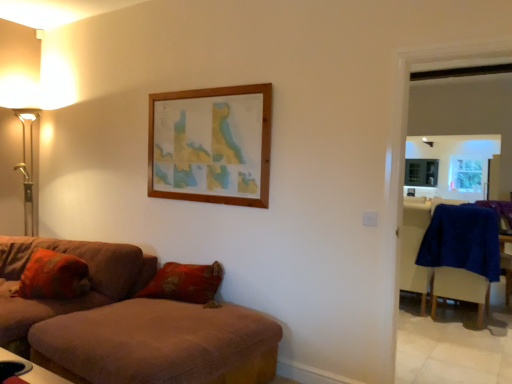
Question: Considering the relative positions of textured orange pillow at lower left and gold metallic floor lamp at left in the image provided, is textured orange pillow at lower left to the left of gold metallic floor lamp at left from the viewer's perspective?

Choices:
 (A) no
 (B) yes

Answer: (A)

Question: Does textured orange pillow at lower left turn towards gold metallic floor lamp at left?

Choices:
 (A) yes
 (B) no

Answer: (B)

Question: Is textured orange pillow at lower left completely or partially outside of gold metallic floor lamp at left?

Choices:
 (A) yes
 (B) no

Answer: (A)

Question: From the image's perspective, does textured orange pillow at lower left appear lower than gold metallic floor lamp at left?

Choices:
 (A) yes
 (B) no

Answer: (A)

Question: Is gold metallic floor lamp at left located within textured orange pillow at lower left?

Choices:
 (A) yes
 (B) no

Answer: (B)

Question: Is the depth of textured orange pillow at lower left greater than that of gold metallic floor lamp at left?

Choices:
 (A) yes
 (B) no

Answer: (B)

Question: Is textured orange pillow at lower left directly adjacent to brown fabric couch at lower left, which is the 1th studio couch in left-to-right order?

Choices:
 (A) yes
 (B) no

Answer: (B)

Question: From a real-world perspective, is textured orange pillow at lower left positioned over brown fabric couch at lower left, which is the 1th studio couch in left-to-right order, based on gravity?

Choices:
 (A) no
 (B) yes

Answer: (B)

Question: Is textured orange pillow at lower left taller than brown fabric couch at lower left, arranged as the 2th studio couch when viewed from the right?

Choices:
 (A) yes
 (B) no

Answer: (B)

Question: Would you consider textured orange pillow at lower left to be distant from brown fabric couch at lower left, arranged as the 2th studio couch when viewed from the right?

Choices:
 (A) yes
 (B) no

Answer: (B)

Question: From the image's perspective, is textured orange pillow at lower left below brown fabric couch at lower left, which is the 1th studio couch in left-to-right order?

Choices:
 (A) no
 (B) yes

Answer: (A)

Question: Is textured orange pillow at lower left smaller than brown fabric couch at lower left, which is the 1th studio couch in left-to-right order?

Choices:
 (A) yes
 (B) no

Answer: (A)

Question: Considering the relative sizes of blue fabric armchair at right and gold metallic floor lamp at left in the image provided, is blue fabric armchair at right thinner than gold metallic floor lamp at left?

Choices:
 (A) no
 (B) yes

Answer: (B)